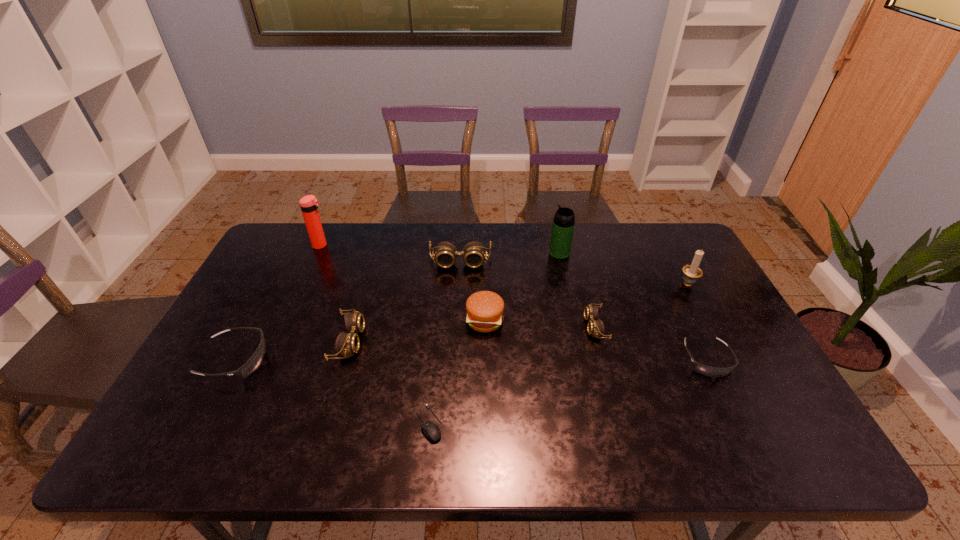
Locate an element on the screen. vacant space that satisfies the following two spatial constraints: 1. from the spout of the green thermos bottle; 2. on the front side of the hamburger is located at coordinates (574, 320).

Identify the location of free location that satisfies the following two spatial constraints: 1. through the lenses of the farthest goggles; 2. through the lenses of the second biggest brown goggles. (456, 341).

The width and height of the screenshot is (960, 540). In order to click on vacant area in the image that satisfies the following two spatial constraints: 1. from the spout of the right thermos bottle; 2. on the front side of the mouse in this screenshot , I will do `click(597, 423)`.

Locate an element on the screen. The height and width of the screenshot is (540, 960). vacant space that satisfies the following two spatial constraints: 1. through the lenses of the farthest brown goggles; 2. on the left side of the hamburger is located at coordinates (457, 320).

The width and height of the screenshot is (960, 540). I want to click on free space that satisfies the following two spatial constraints: 1. from the spout of the right thermos bottle; 2. through the lenses of the third goggles from left to right, so 562,262.